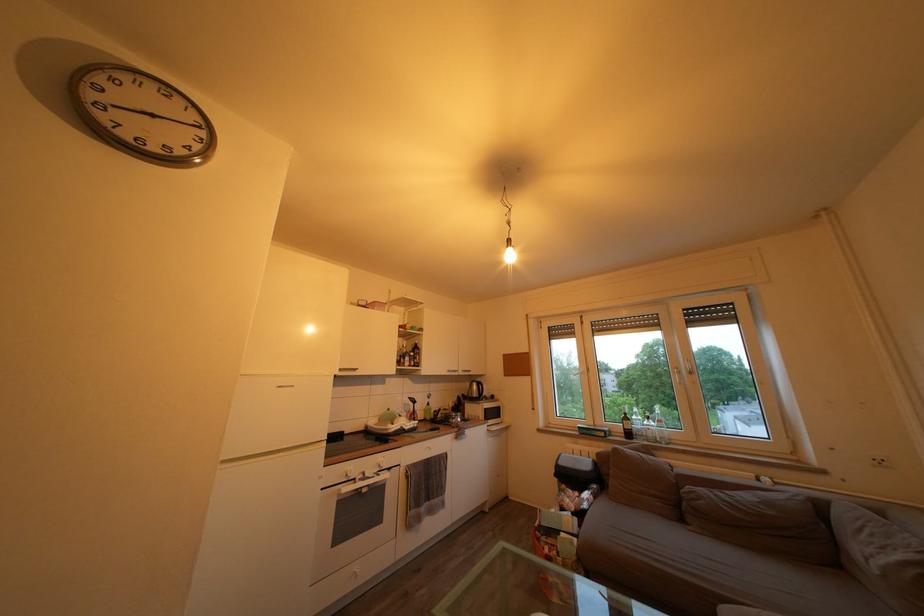
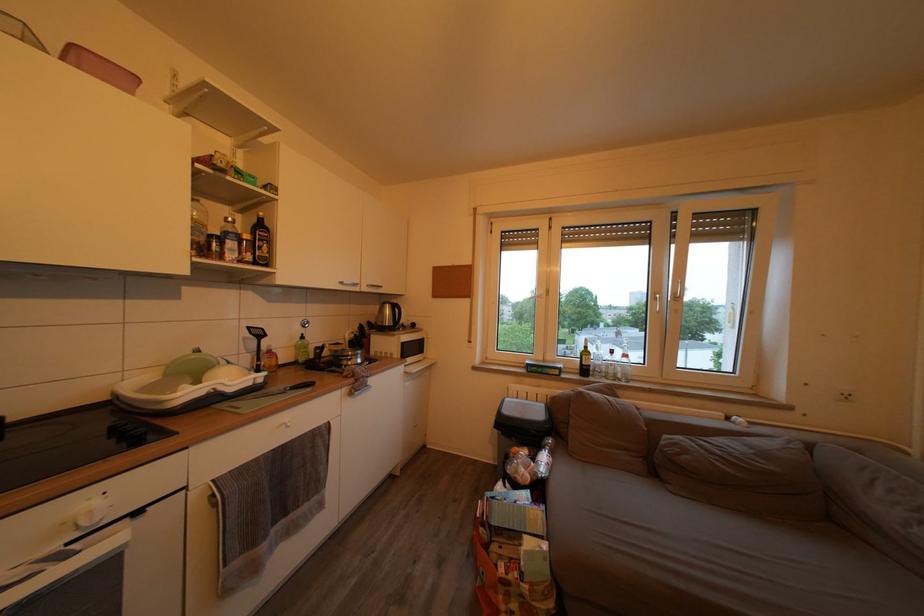
Find the pixel in the second image that matches the point at 647,432 in the first image.

(608, 369)